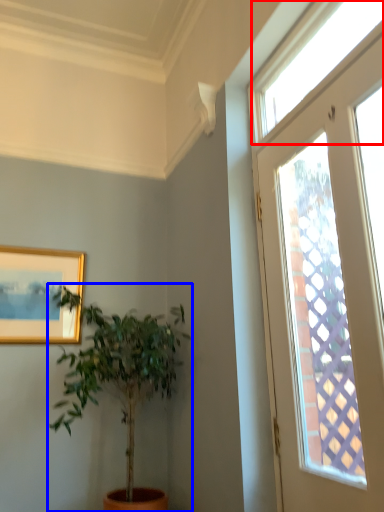
Question: Among these objects, which one is farthest to the camera, window (highlighted by a red box) or houseplant (highlighted by a blue box)?

Choices:
 (A) window
 (B) houseplant

Answer: (B)